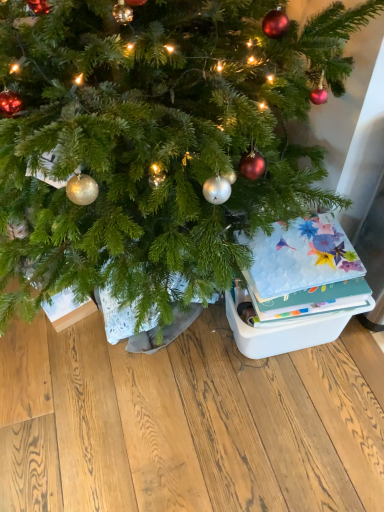
Question: In terms of height, does green matte christmas tree at center look taller or shorter compared to floral-patterned paper at right?

Choices:
 (A) short
 (B) tall

Answer: (A)

Question: Considering their positions, is green matte christmas tree at center located in front of or behind floral-patterned paper at right?

Choices:
 (A) front
 (B) behind

Answer: (A)

Question: Which of these objects is positioned farthest from the white plastic storage box at lower right?

Choices:
 (A) green matte christmas tree at center
 (B) floral-patterned paper at right

Answer: (A)

Question: Estimate the real-world distances between objects in this image. Which object is farther from the floral-patterned paper at right?

Choices:
 (A) green matte christmas tree at center
 (B) white plastic storage box at lower right

Answer: (A)